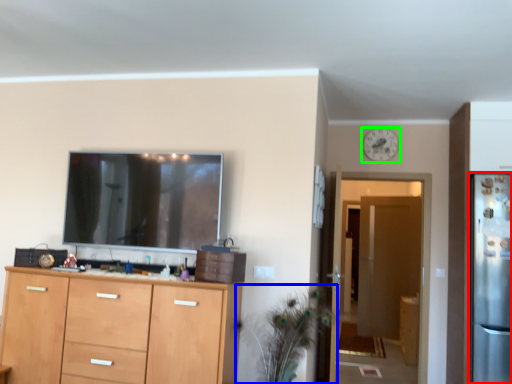
Question: Estimate the real-world distances between objects in this image. Which object is closer to refrigerator (highlighted by a red box), plant (highlighted by a blue box) or clock (highlighted by a green box)?

Choices:
 (A) plant
 (B) clock

Answer: (B)